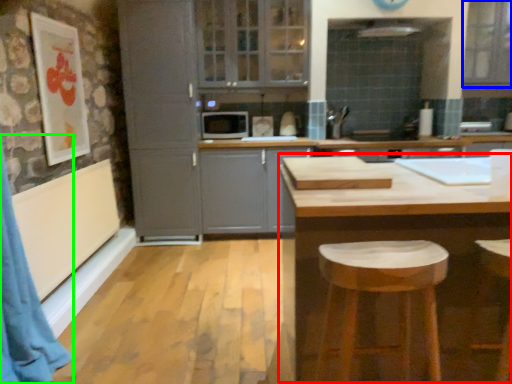
Question: Which object is the closest to the table (highlighted by a red box)? Choose among these: window (highlighted by a blue box) or curtain (highlighted by a green box).

Choices:
 (A) window
 (B) curtain

Answer: (B)